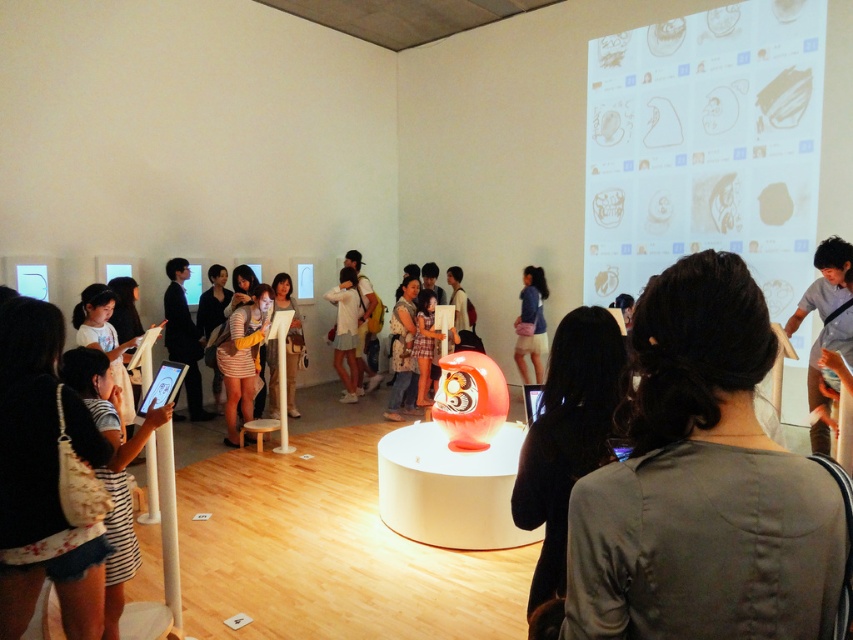
Question: Does black fabric at center have a greater width compared to dark blue suit at center?

Choices:
 (A) no
 (B) yes

Answer: (A)

Question: Observing the image, what is the correct spatial positioning of striped fabric dress at left in reference to blue fabric skirt at center?

Choices:
 (A) below
 (B) above

Answer: (A)

Question: Which point appears closest to the camera in this image?

Choices:
 (A) (277, 401)
 (B) (544, 296)
 (C) (540, 584)
 (D) (822, 282)

Answer: (C)

Question: Is striped fabric dress at left below blue fabric skirt at center?

Choices:
 (A) yes
 (B) no

Answer: (A)

Question: Among these objects, which one is farthest from the camera?

Choices:
 (A) dark blue suit at center
 (B) blue fabric skirt at center
 (C) matte white shirt at center

Answer: (B)

Question: Which point appears closest to the camera in this image?

Choices:
 (A) (816, 580)
 (B) (189, 369)

Answer: (A)